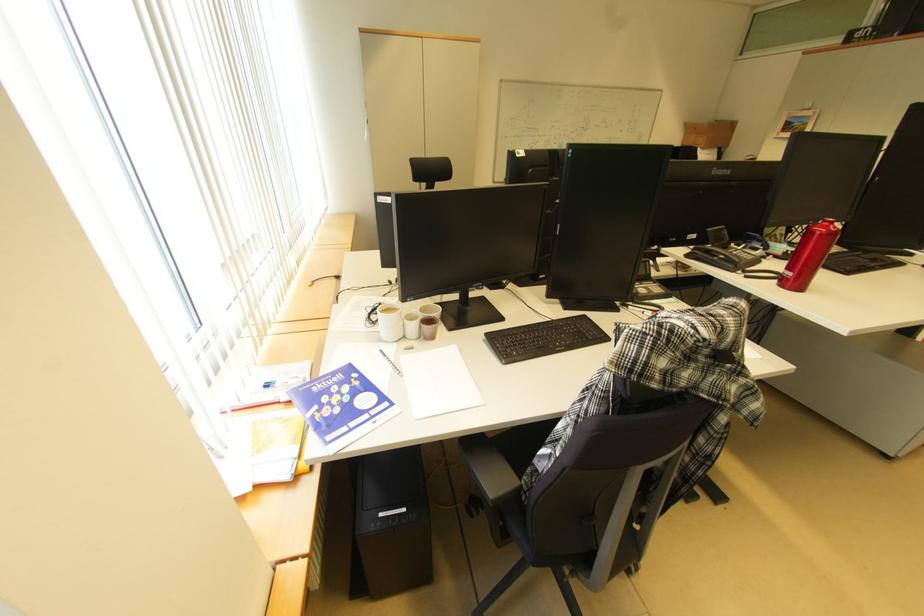
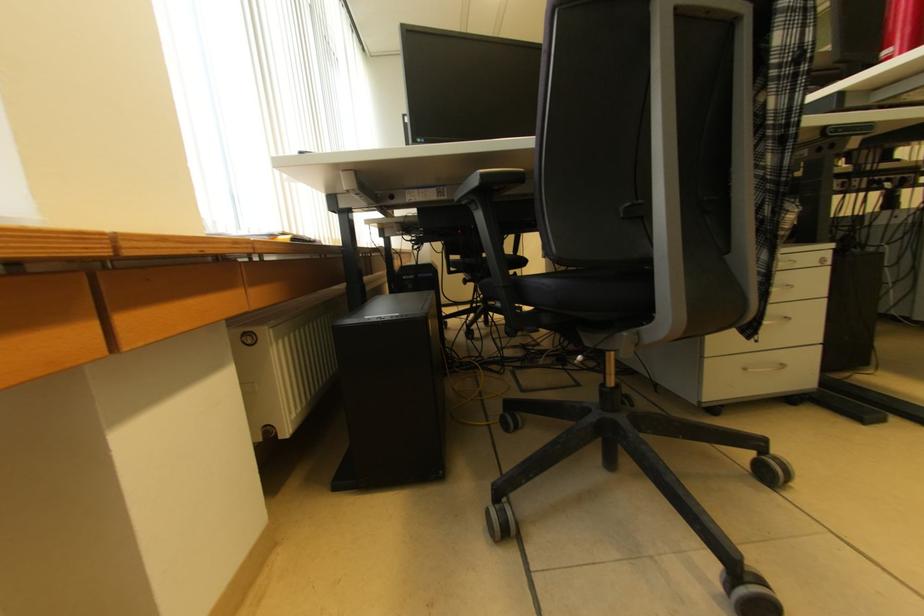
Question: Based on the continuous images, in which direction is the camera rotating? Reply with the corresponding letter.

Choices:
 (A) Left
 (B) Right
 (C) Up
 (D) Down

Answer: (C)